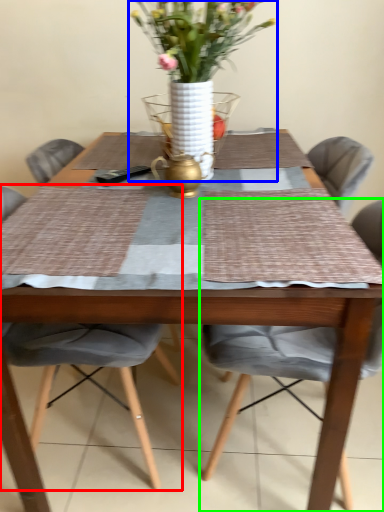
Question: Which object is positioned farthest from chair (highlighted by a red box)? Select from houseplant (highlighted by a blue box) and chair (highlighted by a green box).

Choices:
 (A) houseplant
 (B) chair

Answer: (A)